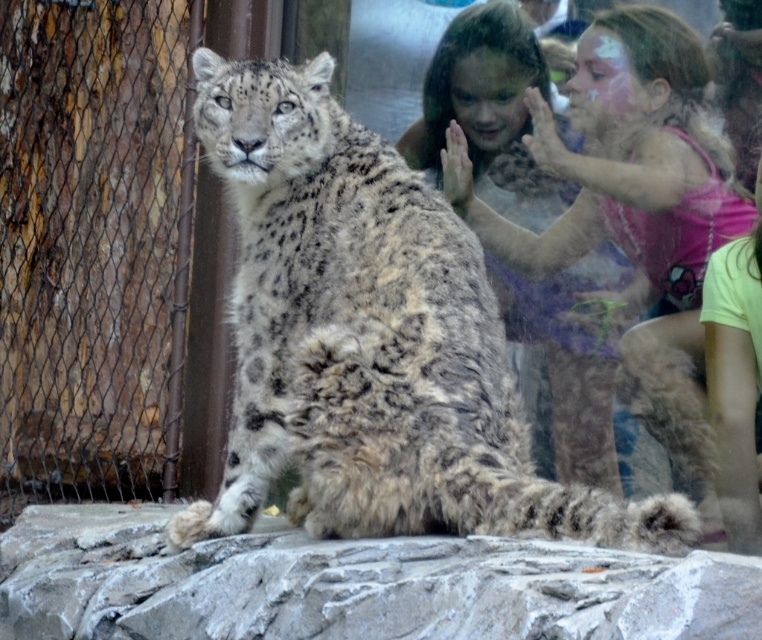
Does point (40, 552) come farther from viewer compared to point (444, 65)?

No, it is not.

Locate an element on the screen. The height and width of the screenshot is (640, 762). gray rough stone at center is located at coordinates (351, 586).

Is spotted fur cheetah at center bigger than gray rough stone at center?

Incorrect, spotted fur cheetah at center is not larger than gray rough stone at center.

Is spotted fur cheetah at center smaller than gray rough stone at center?

Yes, spotted fur cheetah at center is smaller than gray rough stone at center.

Identify the location of spotted fur cheetah at center. This screenshot has height=640, width=762. click(x=370, y=340).

Is point (274, 451) closer to viewer compared to point (524, 324)?

Yes.

The image size is (762, 640). What do you see at coordinates (370, 340) in the screenshot? I see `spotted fur cheetah at center` at bounding box center [370, 340].

Measure the distance between spotted fur cheetah at center and camera.

9.56 meters

Where is `spotted fur cheetah at center`? spotted fur cheetah at center is located at coordinates (370, 340).